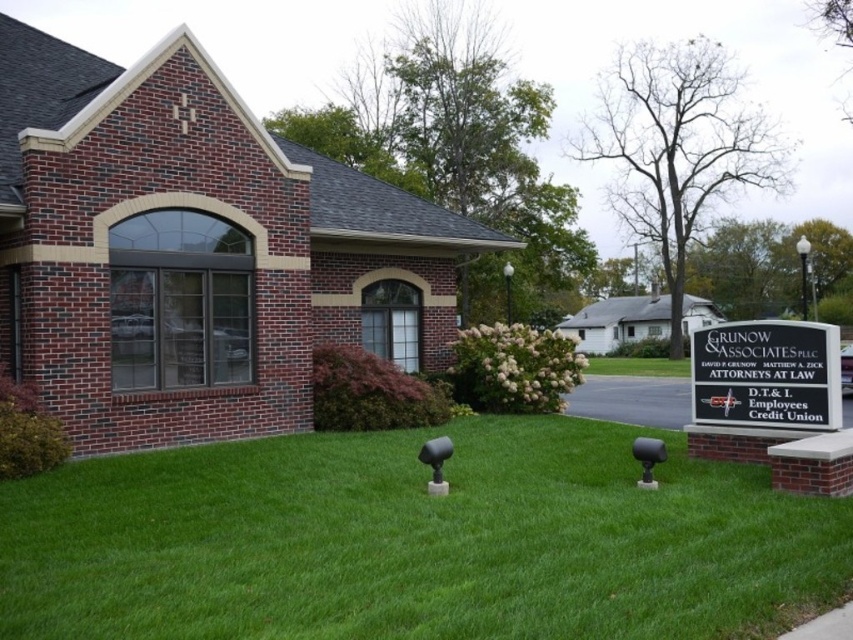
Who is positioned more to the right, green grass at center or black plastic sign at lower right?

black plastic sign at lower right

From the picture: Who is more distant from viewer, (x=299, y=481) or (x=706, y=372)?

The point (x=706, y=372) is behind.

Who is more distant from viewer, (769, 561) or (820, 416)?

The point (820, 416) is behind.

This screenshot has width=853, height=640. In order to click on green grass at center in this screenshot , I will do `click(416, 541)`.